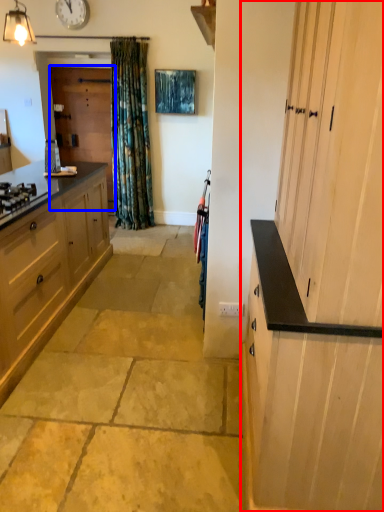
Question: Which of the following is the farthest to the observer, cabinetry (highlighted by a red box) or screen door (highlighted by a blue box)?

Choices:
 (A) cabinetry
 (B) screen door

Answer: (B)